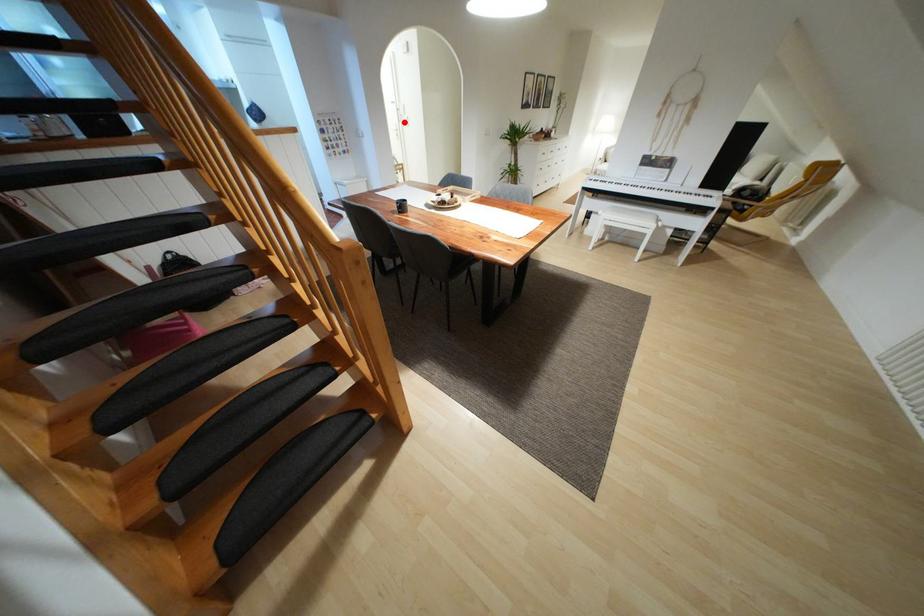
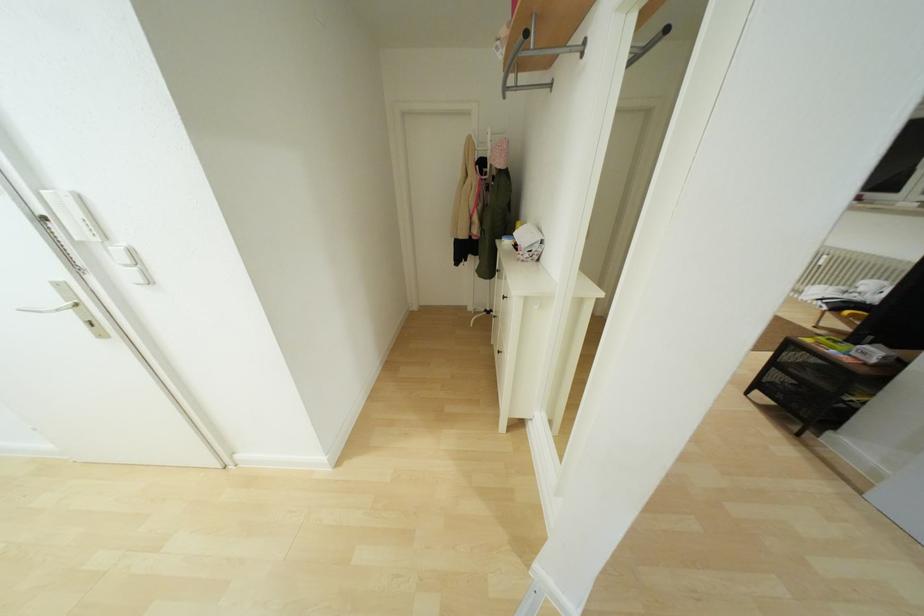
Question: A red point is marked in image1. In image2, is the corresponding 3D point closer to the camera or farther? Reply with the corresponding letter.

Choices:
 (A) The corresponding 3D point is closer.
 (B) The corresponding 3D point is farther.

Answer: (B)